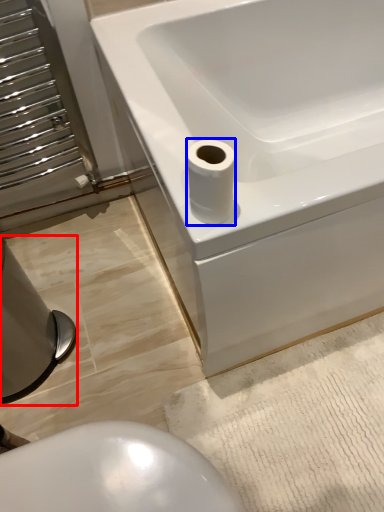
Question: Which point is further to the camera, bidet (highlighted by a red box) or toilet paper (highlighted by a blue box)?

Choices:
 (A) bidet
 (B) toilet paper

Answer: (A)